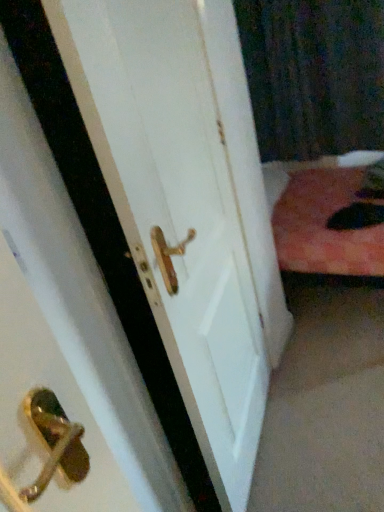
Question: Is fluffy black cat at lower right spatially inside white matte door handle at center, or outside of it?

Choices:
 (A) inside
 (B) outside

Answer: (B)

Question: Is fluffy black cat at lower right bigger or smaller than white matte door handle at center?

Choices:
 (A) small
 (B) big

Answer: (A)

Question: Which is farther from the white matte door handle at center?

Choices:
 (A) black textured curtain at upper right
 (B) fluffy black cat at lower right

Answer: (A)

Question: Considering the real-world distances, which object is closest to the white matte door handle at center?

Choices:
 (A) fluffy black cat at lower right
 (B) black textured curtain at upper right

Answer: (A)